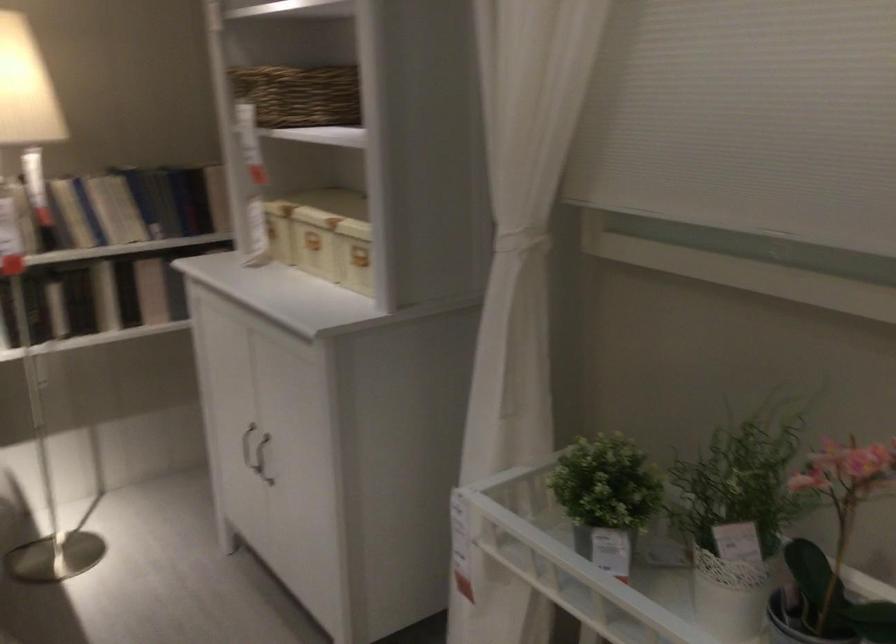
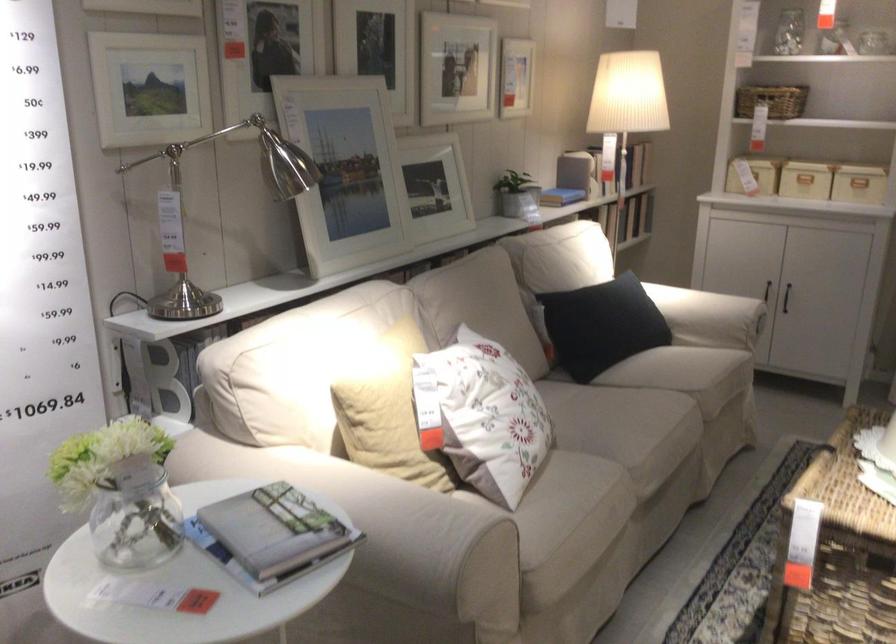
In the second image, find the point that corresponds to (x=265, y=307) in the first image.

(858, 184)